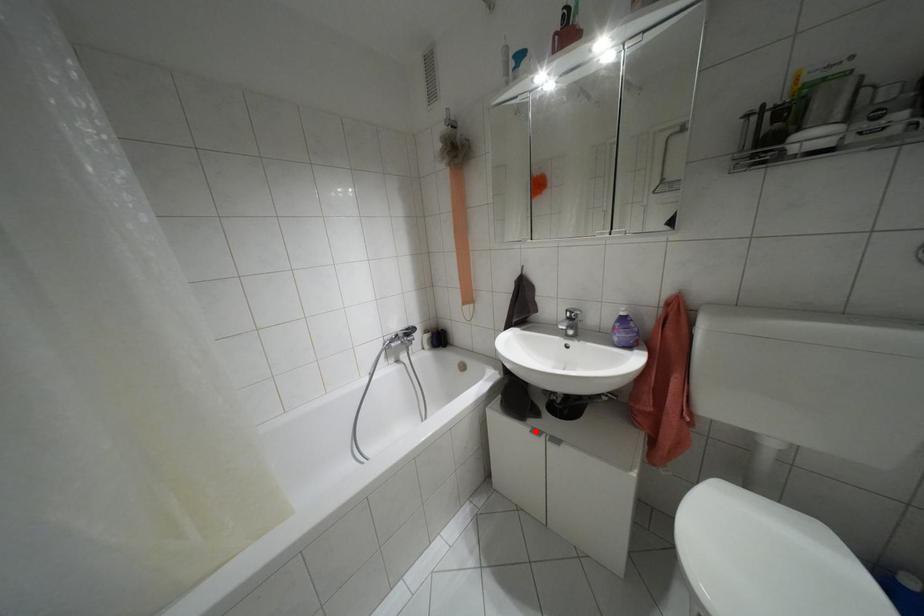
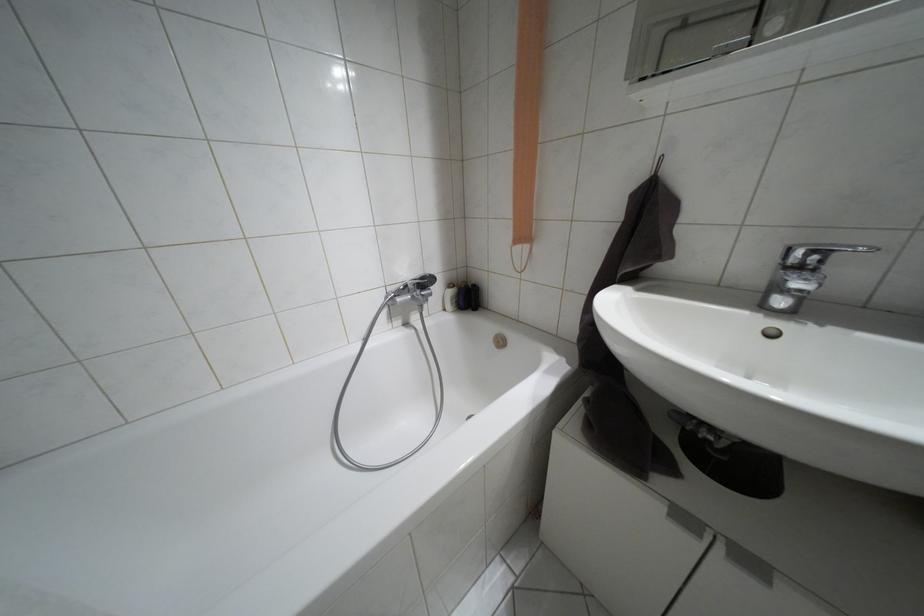
Question: I am providing you with two images of the same scene from different viewpoints. A red point is shown in image1. For the corresponding object point in image2, is it positioned nearer or farther from the camera?

Choices:
 (A) Nearer
 (B) Farther

Answer: (A)